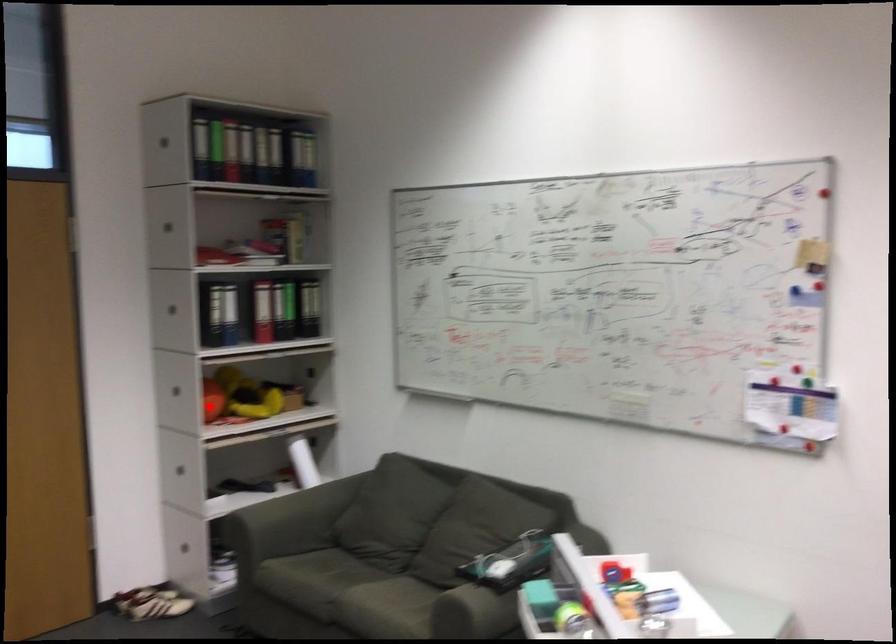
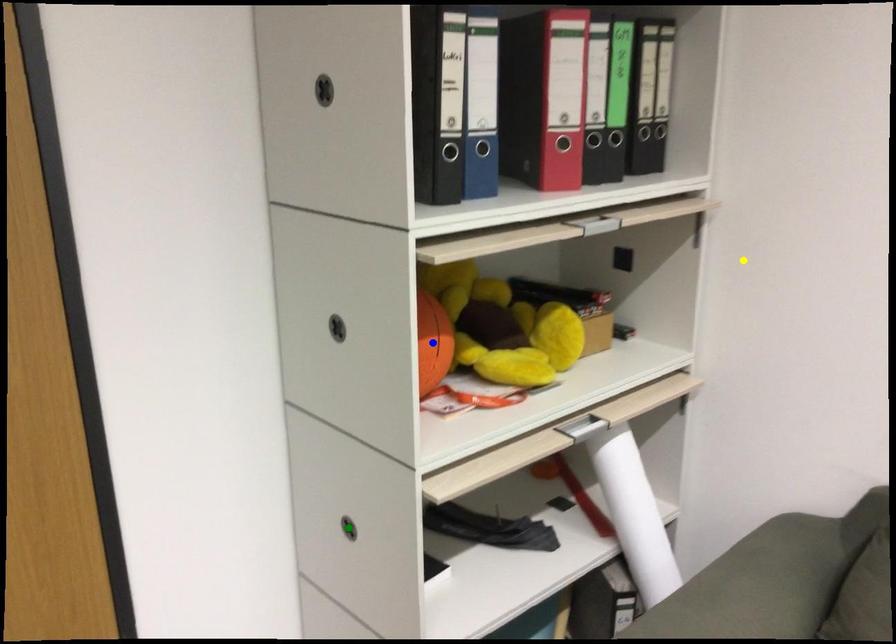
Question: I am providing you with two images of the same scene from different viewpoints. A red point is marked on the first image. You are given multiple points on the second image. Which mark in image 2 goes with the point in image 1?

Choices:
 (A) green point
 (B) blue point
 (C) yellow point

Answer: (B)